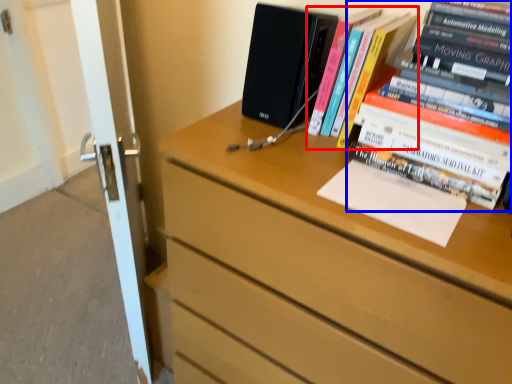
Question: Which object is closer to the camera taking this photo, book (highlighted by a red box) or book (highlighted by a blue box)?

Choices:
 (A) book
 (B) book

Answer: (B)